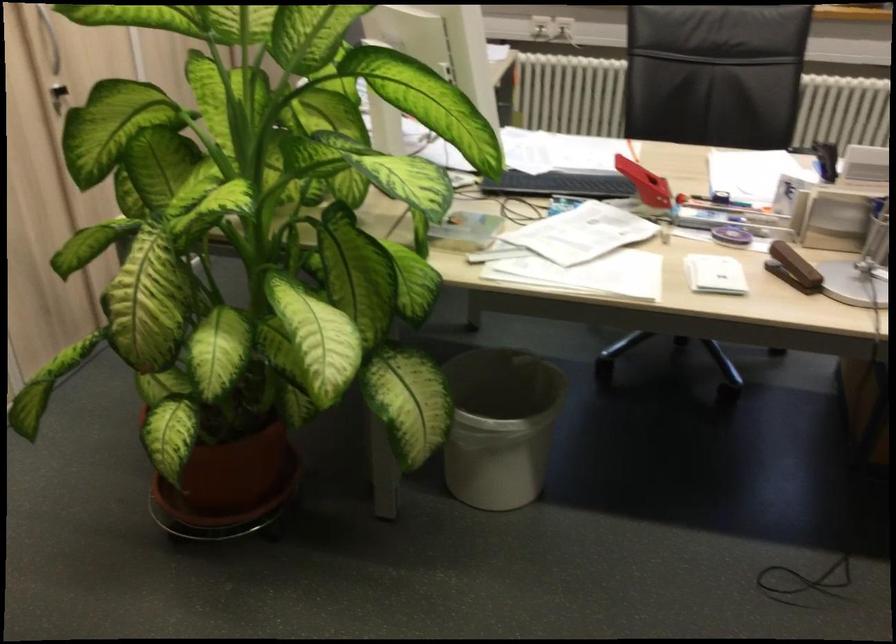
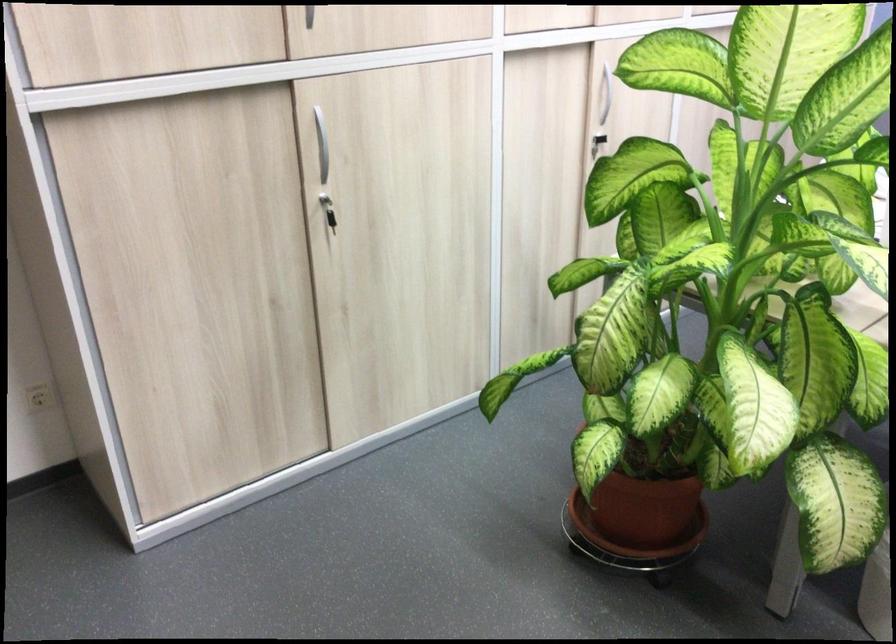
The point at (255, 529) is marked in the first image. Where is the corresponding point in the second image?

(636, 564)